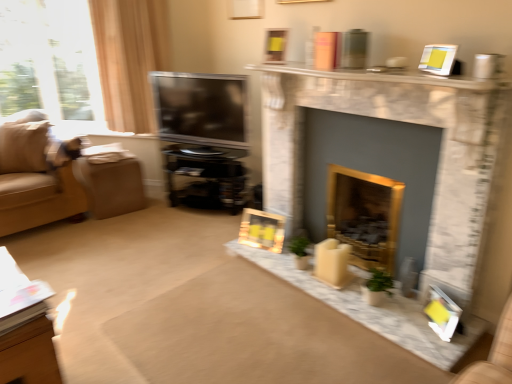
Locate an element on the screen. This screenshot has width=512, height=384. free space in front of wooden picture frame at center, arranged as the third picture frame when viewed from the right is located at coordinates (266, 255).